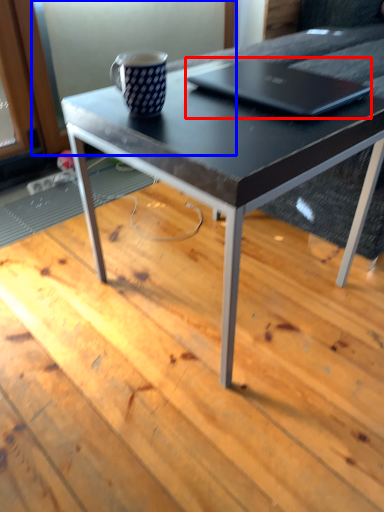
Question: Which object appears farthest to the camera in this image, laptop (highlighted by a red box) or screen door (highlighted by a blue box)?

Choices:
 (A) laptop
 (B) screen door

Answer: (B)